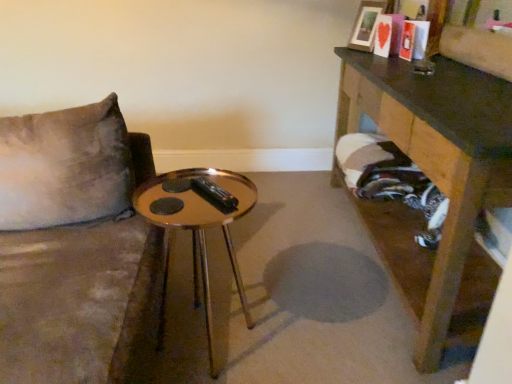
Where is `free space underneath gold reflective table at center, placed as the first table when sorted from left to right (from a real-world perspective)`? The image size is (512, 384). free space underneath gold reflective table at center, placed as the first table when sorted from left to right (from a real-world perspective) is located at coordinates (208, 338).